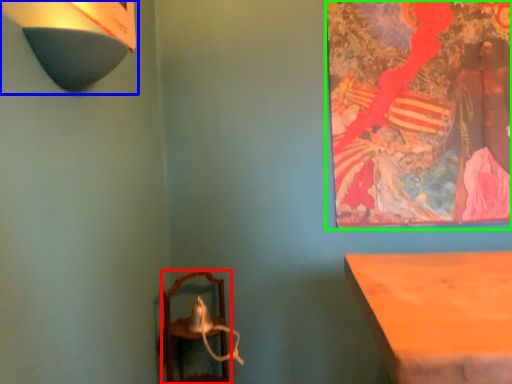
Question: Which object is positioned closest to furniture (highlighted by a red box)? Select from lamp (highlighted by a blue box) and picture frame (highlighted by a green box).

Choices:
 (A) lamp
 (B) picture frame

Answer: (B)